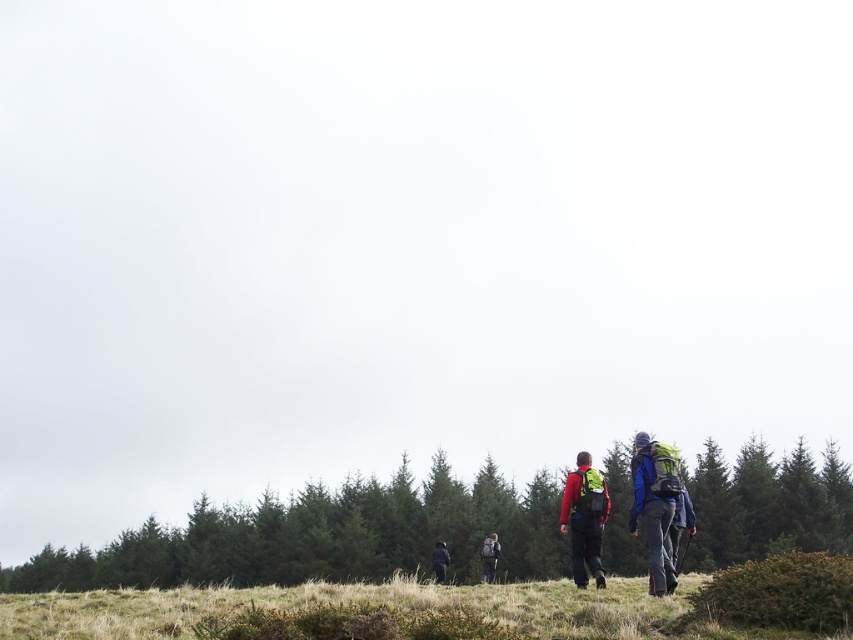
Question: Estimate the real-world distances between objects in this image. Which object is closer to the grassy field at lower center?

Choices:
 (A) blue fabric backpack at right
 (B) green textured trees at lower center
 (C) dark green jacket at center
 (D) matte red jacket at center

Answer: (D)

Question: Does grassy field at lower center appear under dark green jacket at center?

Choices:
 (A) yes
 (B) no

Answer: (B)

Question: Which point is farther to the camera?

Choices:
 (A) green textured trees at lower center
 (B) matte red jacket at center

Answer: (A)

Question: Does matte red jacket at center appear on the left side of green fabric backpack at center?

Choices:
 (A) yes
 (B) no

Answer: (B)

Question: Considering the real-world distances, which object is closest to the grassy field at lower center?

Choices:
 (A) green textured trees at lower center
 (B) dark green jacket at center
 (C) green fabric backpack at center

Answer: (B)

Question: In this image, where is green textured trees at lower center located relative to matte red jacket at center?

Choices:
 (A) left
 (B) right

Answer: (A)